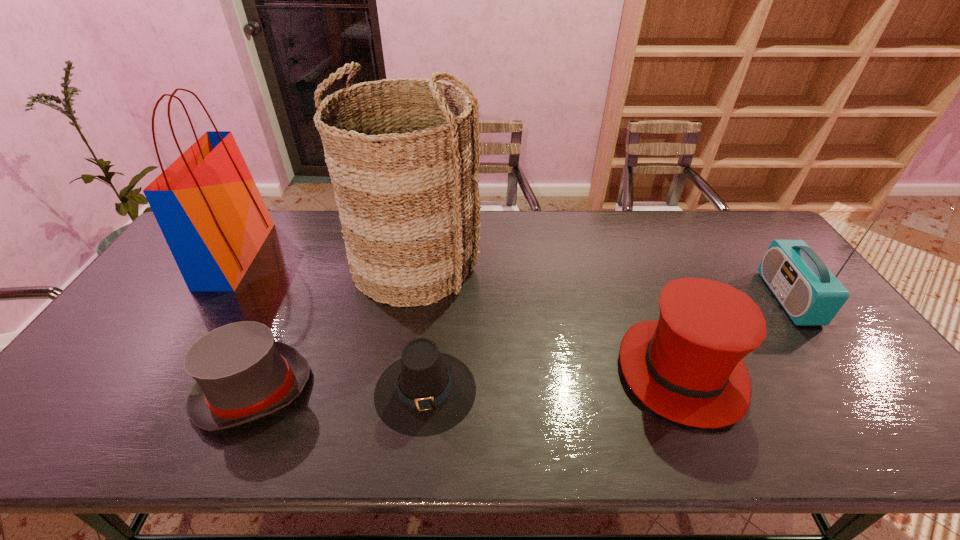
The height and width of the screenshot is (540, 960). I want to click on basket, so click(x=400, y=152).

Image resolution: width=960 pixels, height=540 pixels. I want to click on the leftmost object, so click(207, 205).

Where is `the fourth shortest object`? Image resolution: width=960 pixels, height=540 pixels. the fourth shortest object is located at coordinates (810, 293).

Image resolution: width=960 pixels, height=540 pixels. In order to click on radio receiver in this screenshot , I will do `click(810, 293)`.

Locate an element on the screen. This screenshot has width=960, height=540. the second object from right to left is located at coordinates (688, 367).

Find the location of a particular element. Image resolution: width=960 pixels, height=540 pixels. the rightmost hat is located at coordinates 688,367.

Find the location of a particular element. the leftmost hat is located at coordinates (242, 374).

Where is `the second hat from right to left`? The width and height of the screenshot is (960, 540). the second hat from right to left is located at coordinates (426, 392).

This screenshot has width=960, height=540. Identify the location of free point located on the left of the basket. (334, 264).

Identify the location of vacant position located on the handle side of the leftmost object. The image size is (960, 540). tap(298, 255).